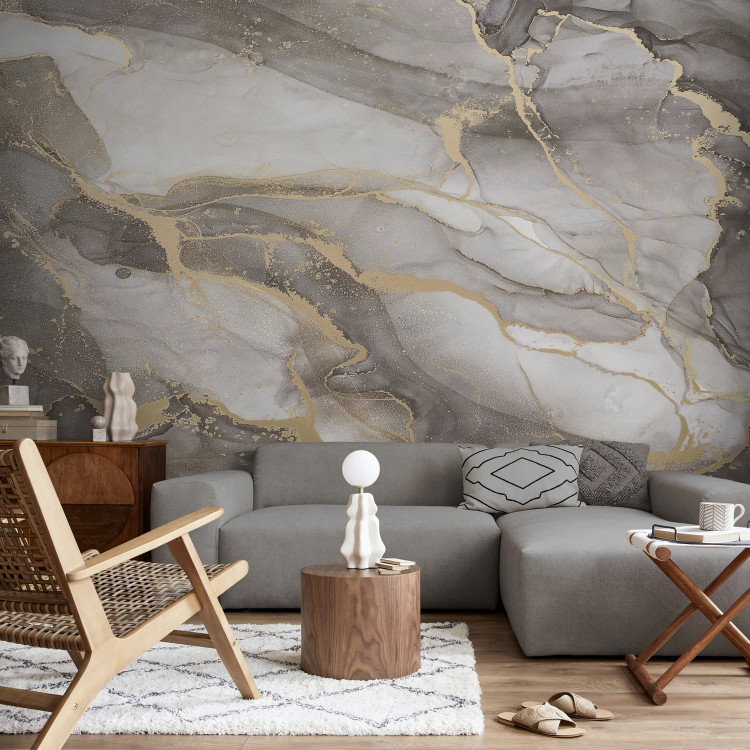
Locate an element on the screen. This screenshot has height=750, width=750. 1 chair is located at coordinates (94, 601).